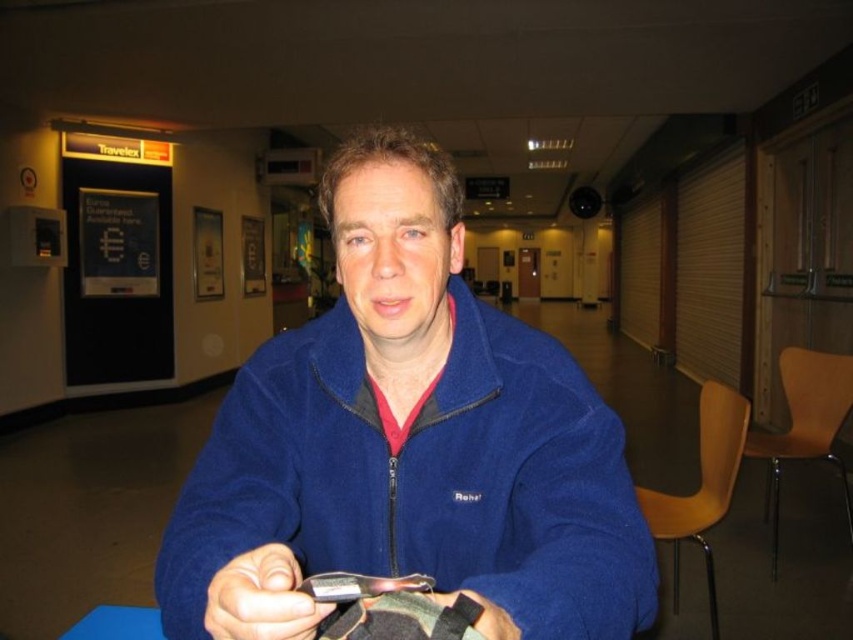
Question: Is blue fleece jacket at center behind black matte wristband at center?

Choices:
 (A) no
 (B) yes

Answer: (A)

Question: Estimate the real-world distances between objects in this image. Which object is farther from the blue matte table at lower left?

Choices:
 (A) matte black phone at lower center
 (B) black matte wristband at center
 (C) blue fleece jacket at center

Answer: (B)

Question: Estimate the real-world distances between objects in this image. Which object is farther from the blue matte table at lower left?

Choices:
 (A) blue fleece jacket at center
 (B) black matte wristband at center
 (C) matte black phone at lower center

Answer: (B)

Question: Does matte black phone at lower center appear over black matte wristband at center?

Choices:
 (A) no
 (B) yes

Answer: (B)

Question: Is blue matte table at lower left positioned at the back of black matte wristband at center?

Choices:
 (A) no
 (B) yes

Answer: (B)

Question: Among these points, which one is nearest to the camera?

Choices:
 (A) (378, 420)
 (B) (77, 636)
 (C) (477, 627)
 (D) (248, 566)

Answer: (C)